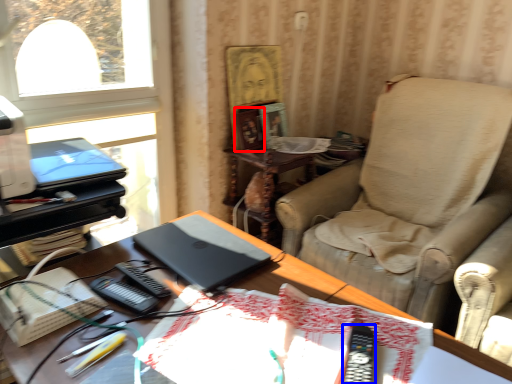
Question: Among these objects, which one is farthest to the camera, picture frame (highlighted by a red box) or equipment (highlighted by a blue box)?

Choices:
 (A) picture frame
 (B) equipment

Answer: (A)